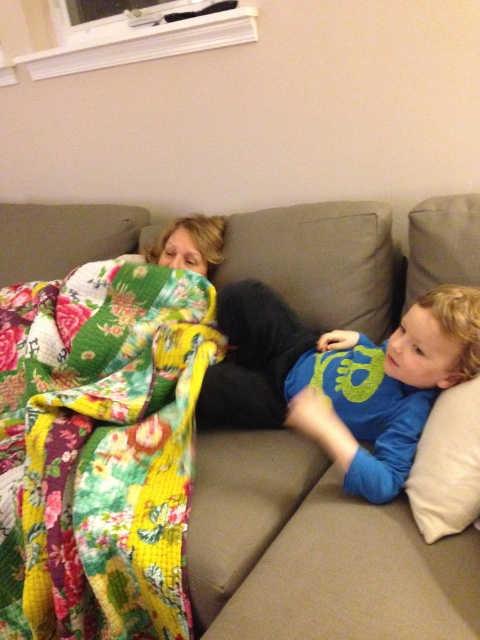
Question: Which object is closer to the camera taking this photo?

Choices:
 (A) white soft pillow at right
 (B) soft gray couch at center
 (C) blue cotton shirt at right

Answer: (A)

Question: Considering the real-world distances, which object is closest to the blue cotton shirt at right?

Choices:
 (A) floral patchwork quilt at left
 (B) white soft pillow at right
 (C) soft gray couch at center

Answer: (B)

Question: Does soft gray couch at center appear on the left side of blue cotton shirt at right?

Choices:
 (A) no
 (B) yes

Answer: (B)

Question: Is floral patchwork quilt at left closer to the viewer compared to blue cotton shirt at right?

Choices:
 (A) no
 (B) yes

Answer: (B)

Question: Is floral patchwork quilt at left to the left of blue cotton shirt at right from the viewer's perspective?

Choices:
 (A) no
 (B) yes

Answer: (B)

Question: Which object appears closest to the camera in this image?

Choices:
 (A) white soft pillow at right
 (B) floral patchwork quilt at left

Answer: (A)